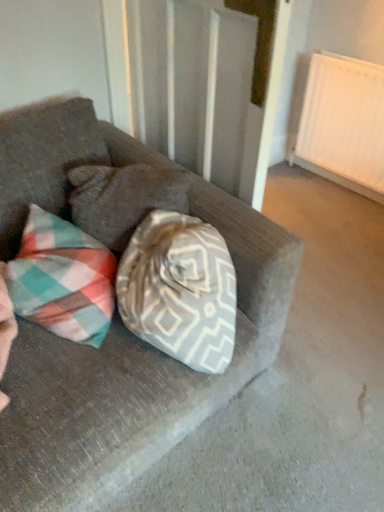
Question: From a real-world perspective, is plaid fabric pillow at center on top of suede couch at center?

Choices:
 (A) no
 (B) yes

Answer: (B)

Question: Is plaid fabric pillow at center at the left side of suede couch at center?

Choices:
 (A) yes
 (B) no

Answer: (B)

Question: Is plaid fabric pillow at center taller than suede couch at center?

Choices:
 (A) yes
 (B) no

Answer: (B)

Question: Does plaid fabric pillow at center touch suede couch at center?

Choices:
 (A) yes
 (B) no

Answer: (B)

Question: Is suede couch at center a part of plaid fabric pillow at center?

Choices:
 (A) no
 (B) yes

Answer: (A)

Question: Visually, is plaid fabric pillow at center positioned to the left or to the right of suede couch at center?

Choices:
 (A) right
 (B) left

Answer: (A)

Question: Considering their positions, is plaid fabric pillow at center located in front of or behind suede couch at center?

Choices:
 (A) front
 (B) behind

Answer: (B)

Question: Considering the positions of point (100, 197) and point (125, 467), is point (100, 197) closer or farther from the camera than point (125, 467)?

Choices:
 (A) farther
 (B) closer

Answer: (A)

Question: Based on their sizes in the image, would you say plaid fabric pillow at center is bigger or smaller than suede couch at center?

Choices:
 (A) small
 (B) big

Answer: (A)

Question: Does point (248, 326) appear closer or farther from the camera than point (211, 180)?

Choices:
 (A) closer
 (B) farther

Answer: (A)

Question: Choose the correct answer: Is suede couch at center inside white textured curtain at upper center or outside it?

Choices:
 (A) outside
 (B) inside

Answer: (A)

Question: Considering the positions of suede couch at center and white textured curtain at upper center in the image, is suede couch at center taller or shorter than white textured curtain at upper center?

Choices:
 (A) short
 (B) tall

Answer: (B)

Question: From the image's perspective, is suede couch at center above or below white textured curtain at upper center?

Choices:
 (A) above
 (B) below

Answer: (B)

Question: Considering the relative positions of white textured curtain at upper center and suede couch at center in the image provided, is white textured curtain at upper center to the left or to the right of suede couch at center?

Choices:
 (A) left
 (B) right

Answer: (B)

Question: From the image's perspective, is white textured curtain at upper center located above or below suede couch at center?

Choices:
 (A) below
 (B) above

Answer: (B)